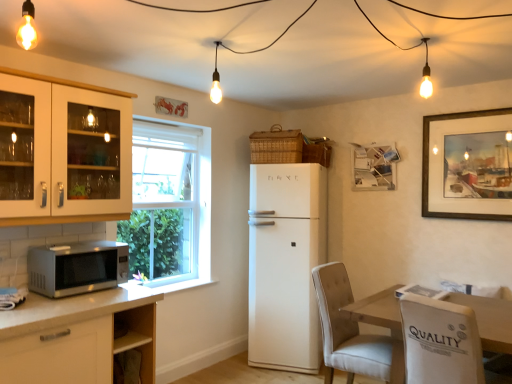
Question: From the image's perspective, is white fabric chair at lower right on top of white glass cabinet at left?

Choices:
 (A) no
 (B) yes

Answer: (A)

Question: From the image's perspective, is white fabric chair at lower right under white glass cabinet at left?

Choices:
 (A) yes
 (B) no

Answer: (A)

Question: Considering the relative sizes of white fabric chair at lower right and white glass cabinet at left in the image provided, is white fabric chair at lower right shorter than white glass cabinet at left?

Choices:
 (A) no
 (B) yes

Answer: (A)

Question: From a real-world perspective, is white fabric chair at lower right physically below white glass cabinet at left?

Choices:
 (A) no
 (B) yes

Answer: (B)

Question: Is white fabric chair at lower right turned away from white glass cabinet at left?

Choices:
 (A) yes
 (B) no

Answer: (B)

Question: From a real-world perspective, relative to wooden framed painting at upper right, is wooden table at lower right vertically above or below?

Choices:
 (A) above
 (B) below

Answer: (B)

Question: In the image, is wooden table at lower right positioned in front of or behind wooden framed painting at upper right?

Choices:
 (A) front
 (B) behind

Answer: (A)

Question: Is wooden table at lower right inside the boundaries of wooden framed painting at upper right, or outside?

Choices:
 (A) inside
 (B) outside

Answer: (B)

Question: Looking at their shapes, would you say wooden table at lower right is wider or thinner than wooden framed painting at upper right?

Choices:
 (A) thin
 (B) wide

Answer: (B)

Question: From the image's perspective, is satin silver microwave at lower left positioned above or below wooden table at lower right?

Choices:
 (A) above
 (B) below

Answer: (A)

Question: Does point (115, 241) appear closer or farther from the camera than point (392, 321)?

Choices:
 (A) farther
 (B) closer

Answer: (A)

Question: From their relative heights in the image, would you say satin silver microwave at lower left is taller or shorter than wooden table at lower right?

Choices:
 (A) tall
 (B) short

Answer: (B)

Question: Visually, is satin silver microwave at lower left positioned to the left or to the right of wooden table at lower right?

Choices:
 (A) left
 (B) right

Answer: (A)

Question: Considering the positions of woven brown basket at upper center, the 1th basket viewed from the right, and white glass cabinet at left in the image, is woven brown basket at upper center, the 1th basket viewed from the right, bigger or smaller than white glass cabinet at left?

Choices:
 (A) big
 (B) small

Answer: (B)

Question: Is point (312, 145) closer or farther from the camera than point (14, 178)?

Choices:
 (A) farther
 (B) closer

Answer: (A)